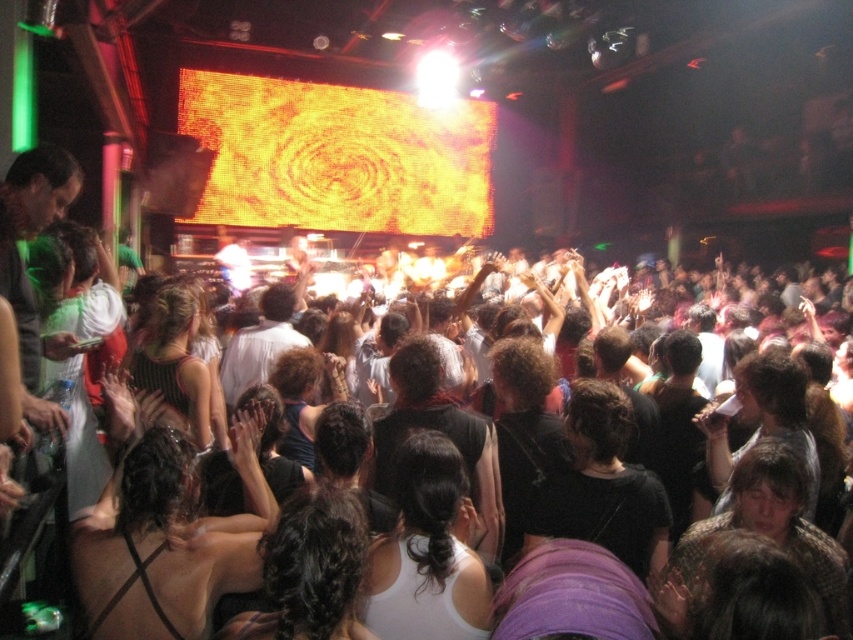
Does black fabric at center appear over black mesh tank top at center?

Incorrect, black fabric at center is not positioned above black mesh tank top at center.

Who is shorter, black fabric at center or black mesh tank top at center?

black mesh tank top at center

The width and height of the screenshot is (853, 640). Describe the element at coordinates (440, 432) in the screenshot. I see `black fabric at center` at that location.

At what (x,y) coordinates should I click in order to perform the action: click on black fabric at center. Please return your answer as a coordinate pair (x, y). This screenshot has width=853, height=640. Looking at the image, I should click on [x=440, y=432].

Based on the photo, does white matte tank top at center appear on the left side of dark curly hair at center?

Indeed, white matte tank top at center is positioned on the left side of dark curly hair at center.

Which is above, white matte tank top at center or dark curly hair at center?

dark curly hair at center

Who is more forward, (407, 554) or (737, 387)?

Positioned in front is point (407, 554).

Image resolution: width=853 pixels, height=640 pixels. I want to click on white matte tank top at center, so click(x=428, y=552).

Is point (115, 602) behind point (468, 512)?

No, it is in front of (468, 512).

Is dark hair at center further to camera compared to white matte tank top at center?

No, dark hair at center is closer to the viewer.

You are a GUI agent. You are given a task and a screenshot of the screen. Output one action in this format:
    pyautogui.click(x=<x>, y=<y>)
    Task: Click on the dark hair at center
    This screenshot has width=853, height=640.
    Given the screenshot: What is the action you would take?
    pyautogui.click(x=166, y=544)